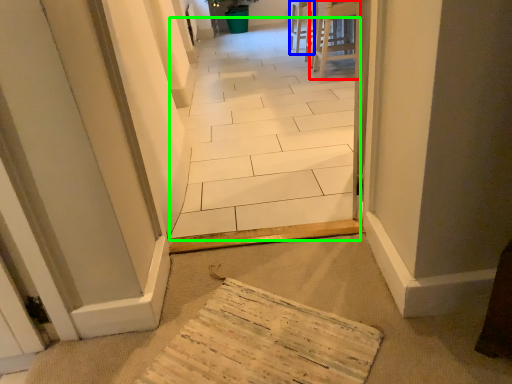
Question: Estimate the real-world distances between objects in this image. Which object is closer to furniture (highlighted by a red box), chair (highlighted by a blue box) or path (highlighted by a green box)?

Choices:
 (A) chair
 (B) path

Answer: (A)